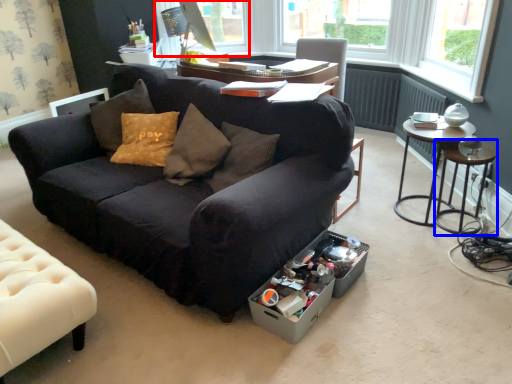
Question: Among these objects, which one is nearest to the camera, window screen (highlighted by a red box) or side table (highlighted by a blue box)?

Choices:
 (A) window screen
 (B) side table

Answer: (B)